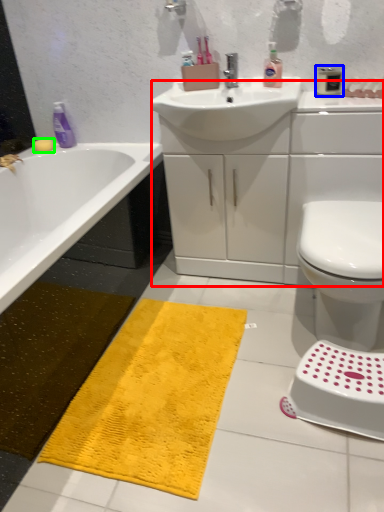
Question: Estimate the real-world distances between objects in this image. Which object is closer to counter top (highlighted by a red box), mouthwash (highlighted by a blue box) or soap (highlighted by a green box)?

Choices:
 (A) mouthwash
 (B) soap

Answer: (A)